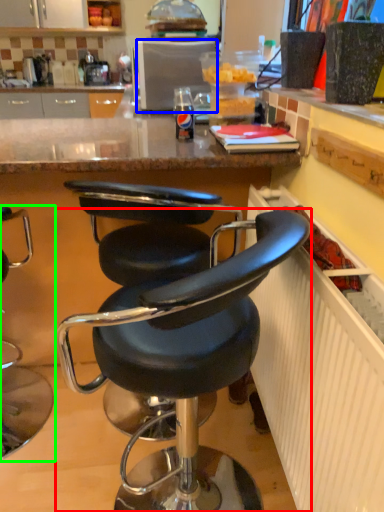
Question: Which object is positioned closest to chair (highlighted by a red box)? Select from appliance (highlighted by a blue box) and chair (highlighted by a green box).

Choices:
 (A) appliance
 (B) chair

Answer: (B)